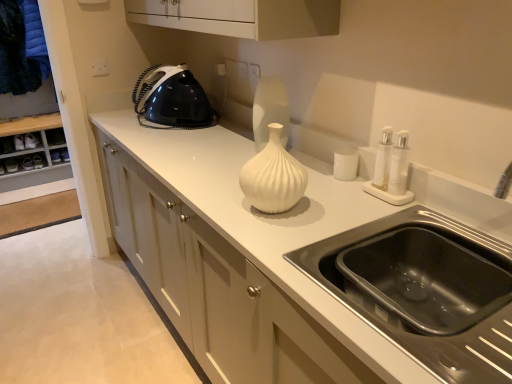
Image resolution: width=512 pixels, height=384 pixels. I want to click on vacant area that lies between white matte vase at center and white matte cup at center, so click(x=323, y=190).